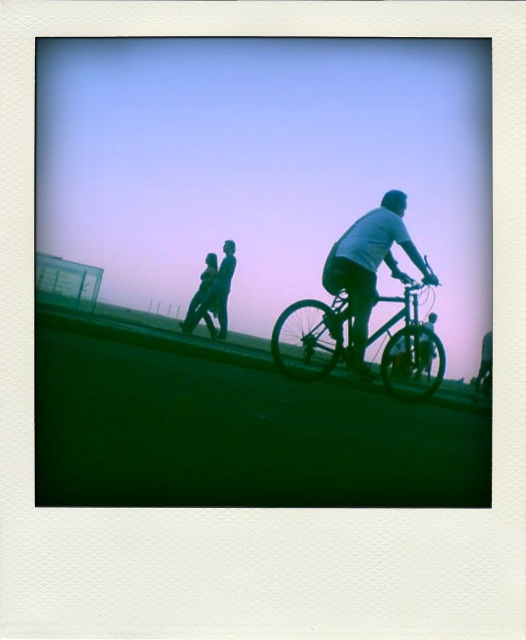
Is point (431, 356) positioned after point (402, 278)?

That is True.

Identify the location of metallic silver bicycle at center. Image resolution: width=526 pixels, height=640 pixels. (311, 339).

At what (x,y) coordinates should I click in order to perform the action: click on metallic silver bicycle at center. Please return your answer as a coordinate pair (x, y). This screenshot has width=526, height=640. Looking at the image, I should click on (311, 339).